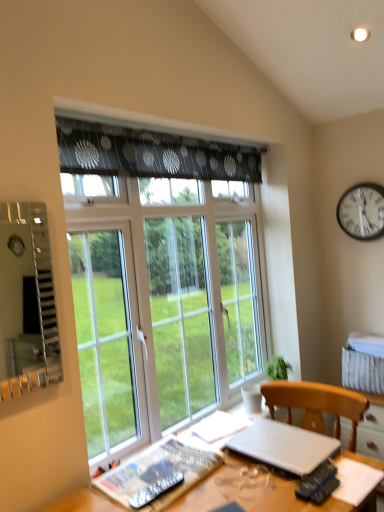
Image resolution: width=384 pixels, height=512 pixels. Identify the location of free spot behind metallic silver remote at lower center. (164, 474).